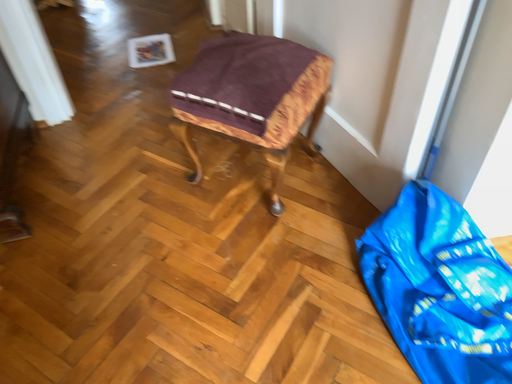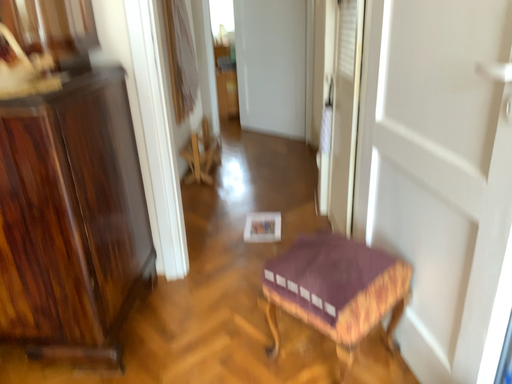
Question: How did the camera likely rotate when shooting the video?

Choices:
 (A) rotated upward
 (B) rotated downward

Answer: (A)